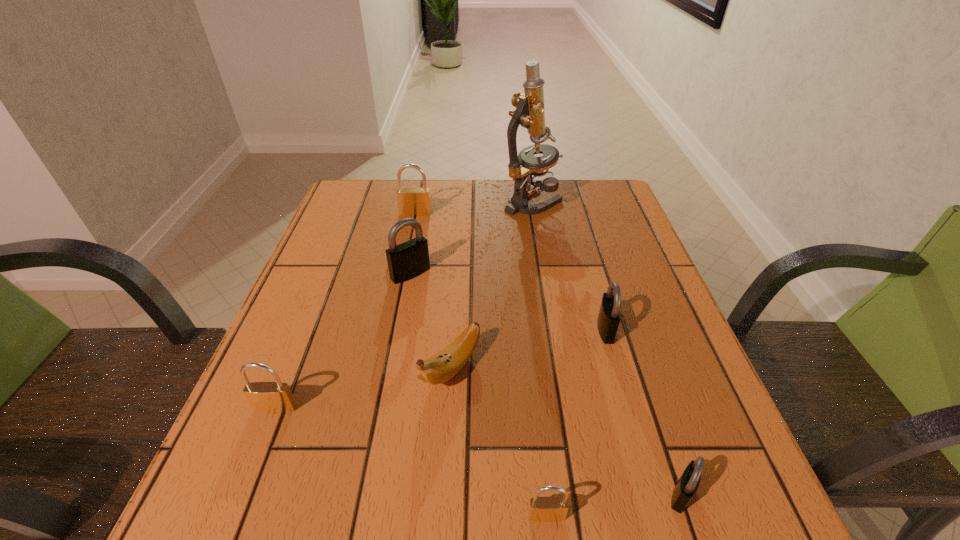
Image resolution: width=960 pixels, height=540 pixels. I want to click on microscope, so click(x=530, y=113).

At what (x,y) coordinates should I click in order to perform the action: click on the biggest brass padlock. Please return your answer as a coordinate pair (x, y). Looking at the image, I should click on (411, 201).

This screenshot has width=960, height=540. What are the coordinates of `the farthest brass padlock` in the screenshot? It's located at (411, 201).

This screenshot has width=960, height=540. I want to click on the biggest black padlock, so click(x=410, y=259).

Identify the location of the sixth nearest object. (410, 259).

In order to click on the second black padlock from right to left in this screenshot , I will do `click(609, 317)`.

Where is `the second farthest black padlock`? The image size is (960, 540). the second farthest black padlock is located at coordinates (609, 317).

Where is `the fourth farthest padlock`? the fourth farthest padlock is located at coordinates (265, 397).

The width and height of the screenshot is (960, 540). Identify the location of the second nearest brass padlock. (265, 397).

Locate an element on the screen. The height and width of the screenshot is (540, 960). banana is located at coordinates (441, 367).